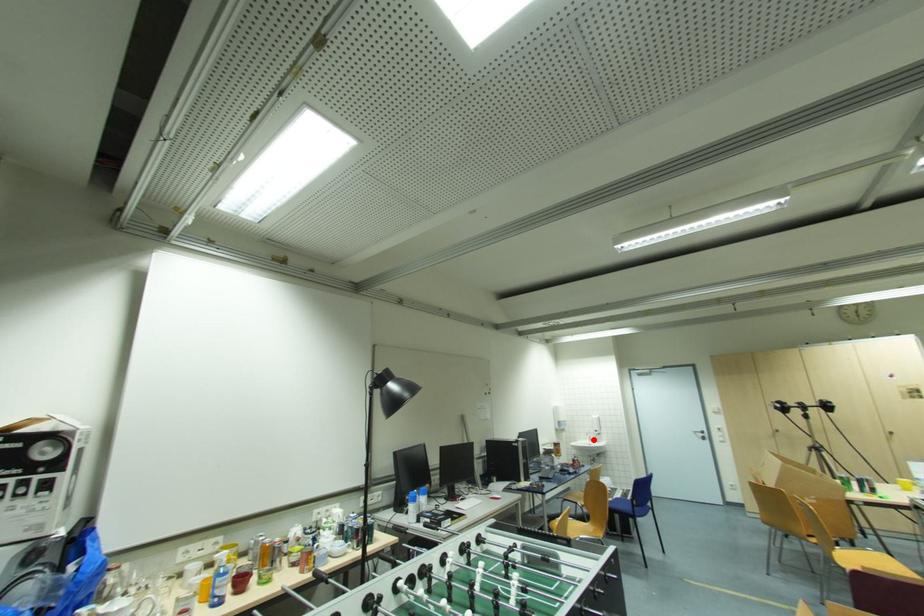
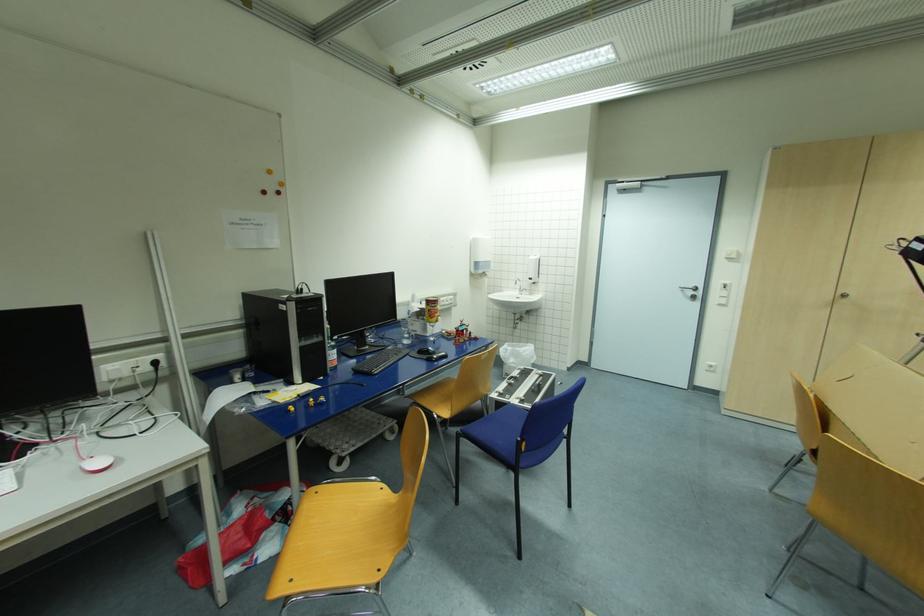
Question: I am providing you with two images of the same scene from different viewpoints. Given a red point in image1, look at the same physical point in image2. Is it:

Choices:
 (A) Closer to the viewpoint
 (B) Farther from the viewpoint

Answer: (A)